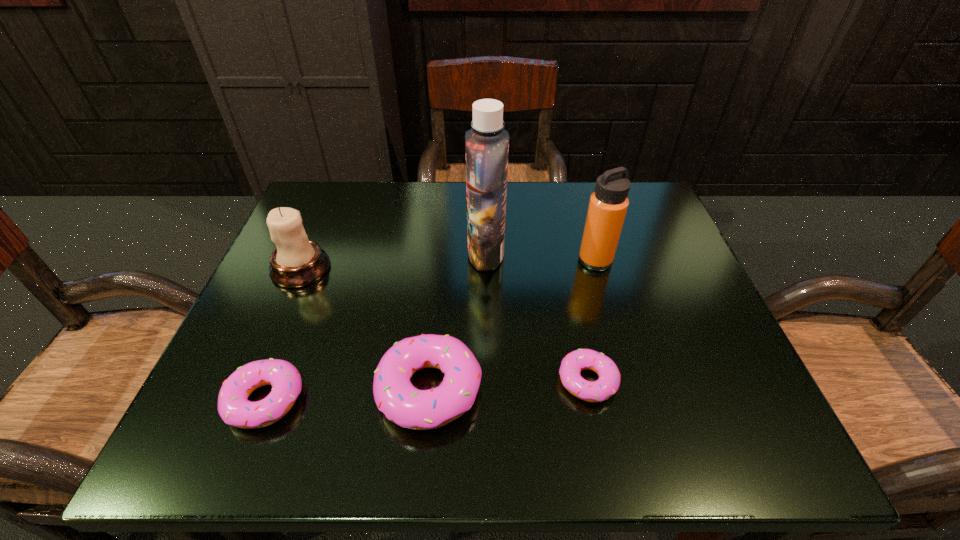
Please point out where to position a new doughnut on the right to maintain spacing. Please provide its 2D coordinates. Your answer should be formatted as a tuple, i.e. [(x, y)], where the tuple contains the x and y coordinates of a point satisfying the conditions above.

[(741, 372)]